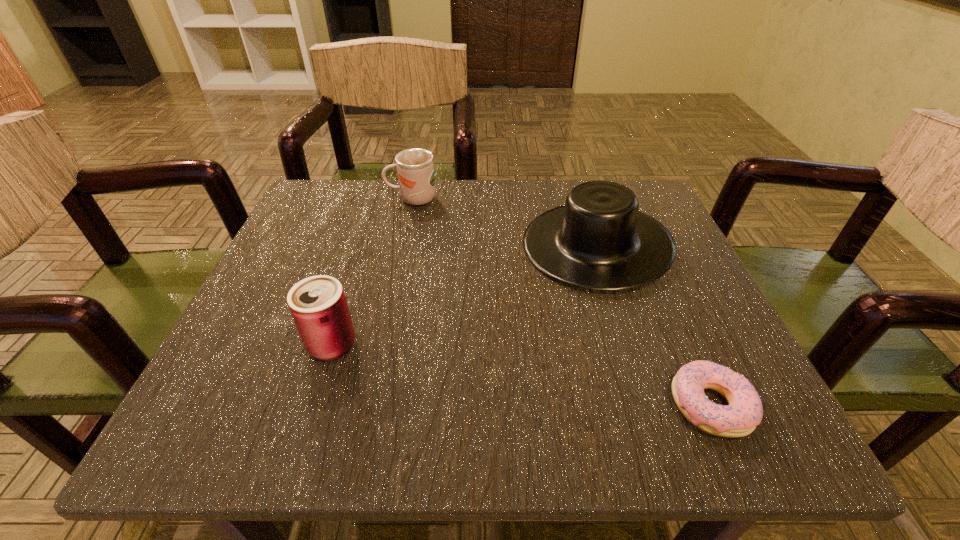
The width and height of the screenshot is (960, 540). What are the coordinates of `vacant area located 0.150m on the back of the shortest object` in the screenshot? It's located at (664, 298).

In order to click on cup that is at the far edge in this screenshot , I will do `click(415, 168)`.

Where is `dress hat that is at the far edge`? The image size is (960, 540). dress hat that is at the far edge is located at coordinates (599, 240).

Identify the location of object that is positioned at the near edge. (738, 419).

This screenshot has width=960, height=540. I want to click on object located in the left edge section of the desktop, so click(x=318, y=305).

Find the location of a particular element. The width and height of the screenshot is (960, 540). dress hat located at the right edge is located at coordinates (599, 240).

Identify the location of doughnut located in the right edge section of the desktop. The width and height of the screenshot is (960, 540). (738, 419).

At what (x,y) coordinates should I click in order to perform the action: click on object located at the far right corner. Please return your answer as a coordinate pair (x, y). Looking at the image, I should click on (599, 240).

Find the location of `object at the near right corner`. object at the near right corner is located at coordinates (738, 419).

Find the location of a particular element. This screenshot has height=540, width=960. vacant point at the far edge is located at coordinates (500, 243).